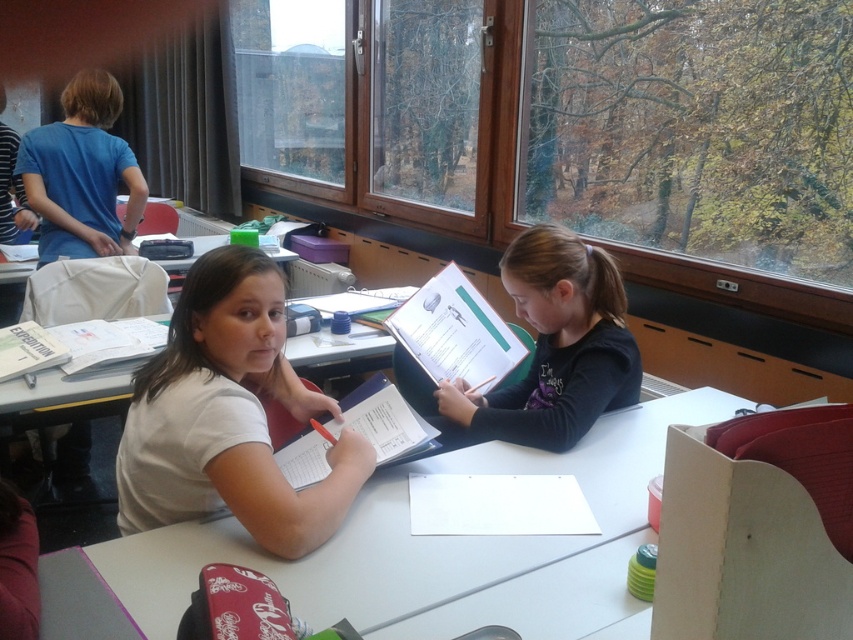
You are a student trying to reach the matte blue binder at center without moving the white matte shirt at center. Is this possible?

The white matte shirt at center is positioned under the matte blue binder at center, so the matte blue binder is above it. Since the shirt is underneath, you can reach the matte blue binder at center without moving the white matte shirt at center.

You are a student who wants to place a new textbook on the white plastic table at center. Considering the height of the table and the white matte shirt at center, will the textbook be visible from above the table?

The white plastic table at center has a lesser height compared to white matte shirt at center, so the textbook placed on the table will be partially obscured by the shirt.

Looking at this image, you are a student trying to organize your desk. You have a matte black shirt at center and a blue cotton shirt at upper left on your desk. Which shirt is positioned to the right of the other?

The matte black shirt at center is positioned to the right of the blue cotton shirt at upper left.